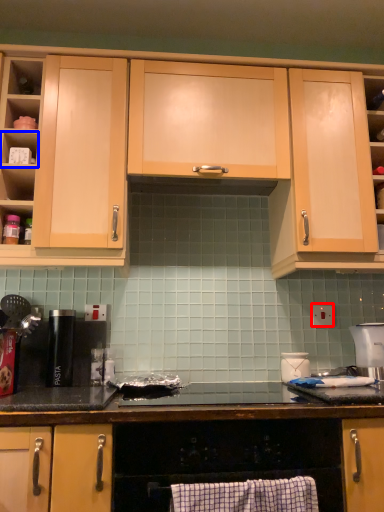
Question: Which point is closer to the camera, electric outlet (highlighted by a red box) or shelf (highlighted by a blue box)?

Choices:
 (A) electric outlet
 (B) shelf

Answer: (B)